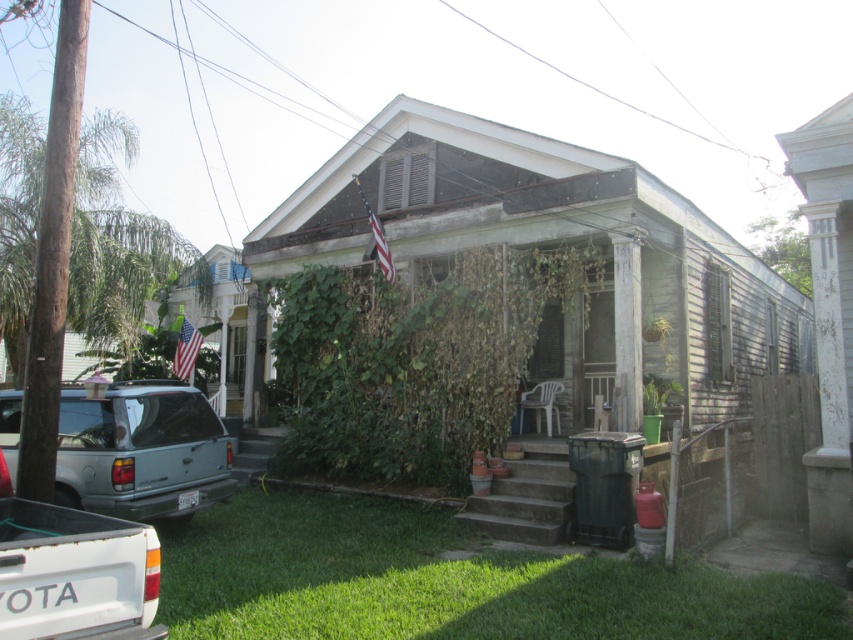
Between metallic silver suv at lower left and white matte truck at lower left, which one is positioned higher?

white matte truck at lower left is higher up.

Is metallic silver suv at lower left bigger than white matte truck at lower left?

Correct, metallic silver suv at lower left is larger in size than white matte truck at lower left.

Is point (132, 404) behind point (49, 528)?

Yes, point (132, 404) is behind point (49, 528).

The image size is (853, 640). I want to click on metallic silver suv at lower left, so click(x=141, y=451).